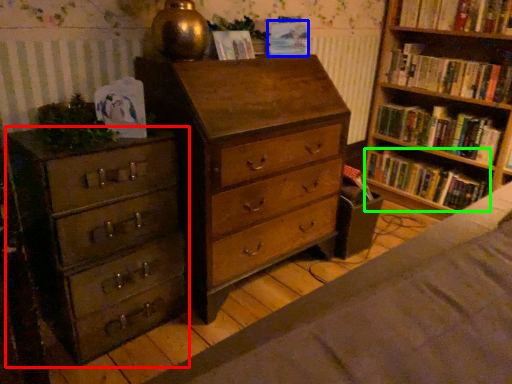
Question: Based on their relative distances, which object is nearer to chest of drawers (highlighted by a red box)? Choose from paperback book (highlighted by a blue box) and book (highlighted by a green box).

Choices:
 (A) paperback book
 (B) book

Answer: (A)